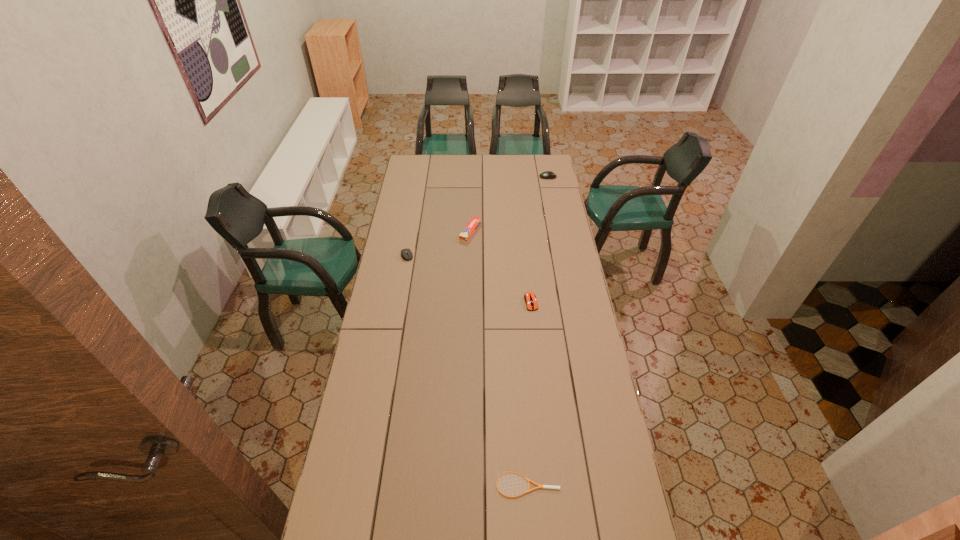
You are a GUI agent. You are given a task and a screenshot of the screen. Output one action in this format:
    pyautogui.click(x=<x>, y=<y>)
    Task: Click on the second object from left to right
    
    Given the screenshot: What is the action you would take?
    pyautogui.click(x=468, y=231)

You are a GUI agent. You are given a task and a screenshot of the screen. Output one action in this format:
    pyautogui.click(x=<x>, y=<y>)
    Task: Click on the toothpaste
    
    Given the screenshot: What is the action you would take?
    pyautogui.click(x=468, y=231)

What are the coordinates of `the farthest computer mouse` in the screenshot? It's located at (548, 174).

This screenshot has height=540, width=960. I want to click on the rightmost object, so click(x=548, y=174).

I want to click on the leftmost object, so click(404, 252).

I want to click on the second farthest computer mouse, so click(x=404, y=252).

The height and width of the screenshot is (540, 960). In order to click on the nearest computer mouse in this screenshot , I will do `click(530, 299)`.

The image size is (960, 540). What are the coordinates of `the second computer mouse from left to right` in the screenshot? It's located at (530, 299).

Locate an element on the screen. the nearest object is located at coordinates (539, 486).

The image size is (960, 540). In order to click on tennis racket in this screenshot , I will do `click(539, 486)`.